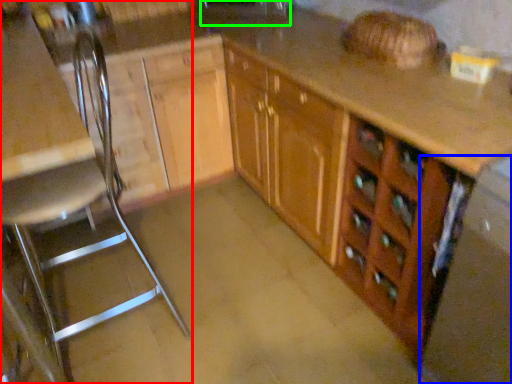
Question: Which is nearer to the chair (highlighted by a red box)? appliance (highlighted by a blue box) or sink (highlighted by a green box).

Choices:
 (A) appliance
 (B) sink

Answer: (B)